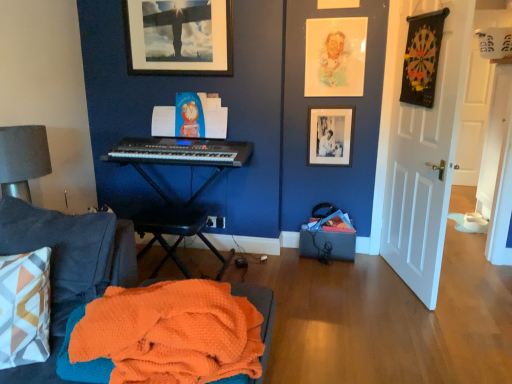
I want to click on free location in front of black fabric box at lower right, so [x=332, y=278].